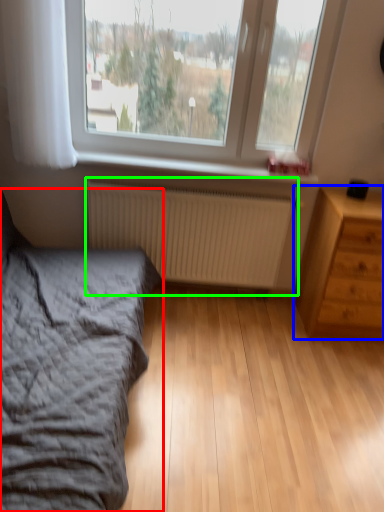
Question: Based on their relative distances, which object is farther from bed (highlighted by a red box)? Choose from chest of drawers (highlighted by a blue box) and radiator (highlighted by a green box).

Choices:
 (A) chest of drawers
 (B) radiator

Answer: (A)